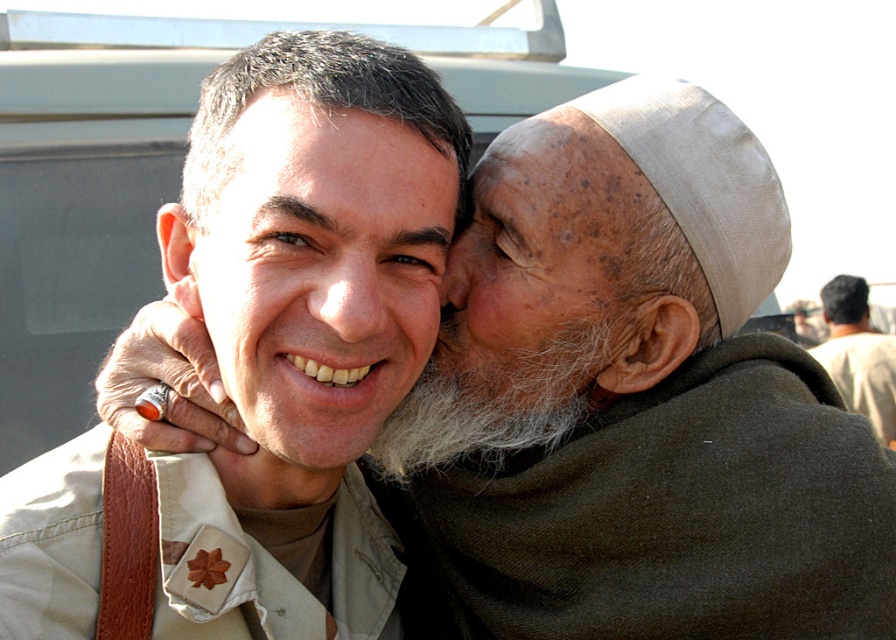
You are a photographer trying to capture a candid shot of the dry skin ear at center and the beige fabric headscarf at upper right. Since you want to ensure both subjects are in focus, which one should you focus on first to maintain depth of field?

The beige fabric headscarf at upper right is to the right of dry skin ear at center, so focusing on the dry skin ear at center first would help maintain depth of field as it is closer to the camera.